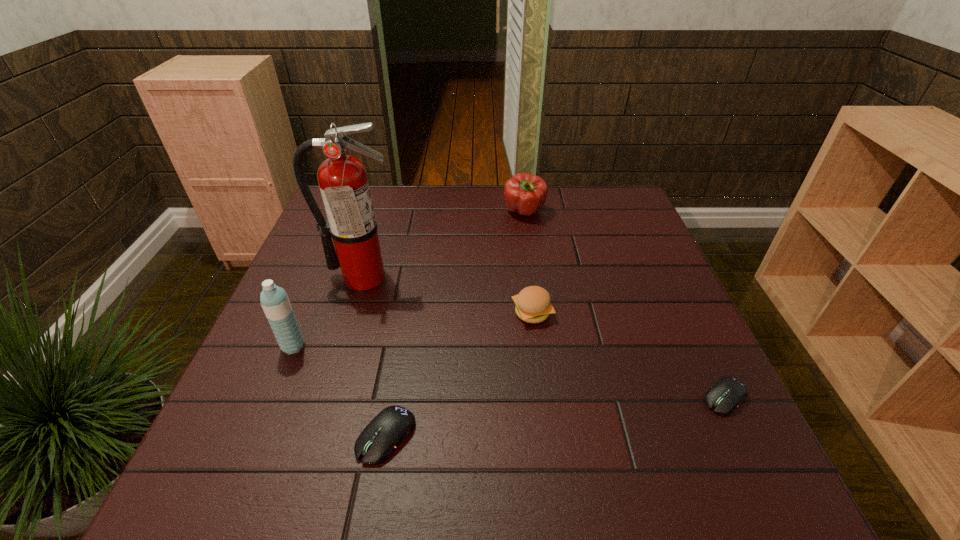
Locate an element on the screen. object that can be found as the fourth closest to the fifth tallest object is located at coordinates (725, 396).

Identify the location of free space that satisfies the following two spatial constraints: 1. on the nozzle side of the tallest object; 2. on the left side of the third shortest object. Image resolution: width=960 pixels, height=540 pixels. (352, 313).

Where is `free location that satisfies the following two spatial constraints: 1. on the front side of the taller computer equipment; 2. on the right side of the second tallest object`? The height and width of the screenshot is (540, 960). free location that satisfies the following two spatial constraints: 1. on the front side of the taller computer equipment; 2. on the right side of the second tallest object is located at coordinates (256, 436).